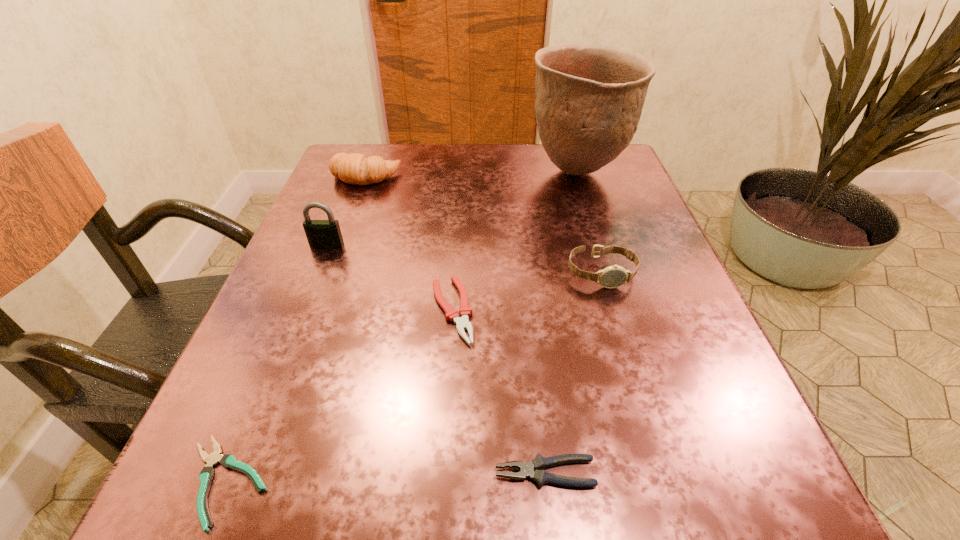
This screenshot has width=960, height=540. Find the location of `empty space that is in between the rightmost pliers and the fifth nearest object`. empty space that is in between the rightmost pliers and the fifth nearest object is located at coordinates (436, 359).

Locate an element on the screen. The height and width of the screenshot is (540, 960). vacant area that lies between the second pliers from right to left and the rightmost pliers is located at coordinates (498, 392).

The height and width of the screenshot is (540, 960). In order to click on free space between the rightmost pliers and the second pliers from right to left in this screenshot , I will do `click(498, 392)`.

At what (x,y) coordinates should I click in order to perform the action: click on free space between the rightmost pliers and the padlock. Please return your answer as a coordinate pair (x, y). Image resolution: width=960 pixels, height=540 pixels. Looking at the image, I should click on (436, 359).

Where is `blank region between the fifth shortest object and the tallest object`? This screenshot has width=960, height=540. blank region between the fifth shortest object and the tallest object is located at coordinates (471, 174).

Find the location of `object that is the fifth closest to the fifth shortest object`. object that is the fifth closest to the fifth shortest object is located at coordinates (229, 461).

Point out which object is positioned as the sixth nearest to the rightmost pliers. Please provide its 2D coordinates. Your answer should be formatted as a tuple, i.e. [(x, y)], where the tuple contains the x and y coordinates of a point satisfying the conditions above.

[(355, 168)]

Select which pliers appears as the second closest to the shortest pliers. Please provide its 2D coordinates. Your answer should be formatted as a tuple, i.e. [(x, y)], where the tuple contains the x and y coordinates of a point satisfying the conditions above.

[(538, 464)]

Identify which pliers is located as the nearest to the crescent roll. Please provide its 2D coordinates. Your answer should be formatted as a tuple, i.e. [(x, y)], where the tuple contains the x and y coordinates of a point satisfying the conditions above.

[(462, 323)]

This screenshot has width=960, height=540. In order to click on vacant space that satisfies the following two spatial constraints: 1. on the back side of the pottery; 2. on the left side of the shortest pliers in this screenshot , I will do `click(353, 172)`.